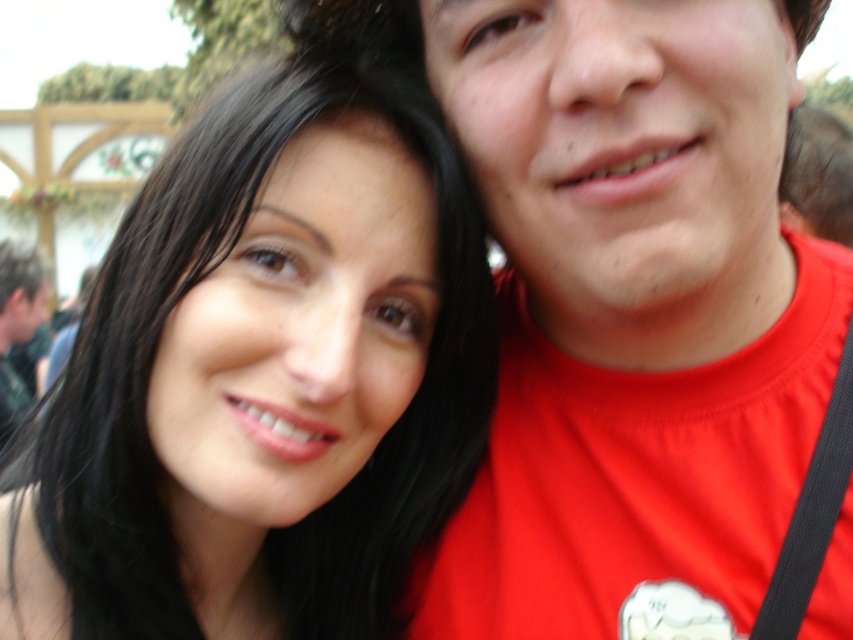
Please look at the image and identify the object located at the coordinates point (x=262, y=378). Your answer should specify the exact object label from the provided list.

The point (x=262, y=378) indicates smooth black hair at upper left.

You are a photographer trying to adjust the focus of your camera. The camera has a focus point at coordinate 0.5, 0.3. Which object in the scene should you focus on to capture the smooth black hair at upper left clearly?

The smooth black hair at upper left is located at point (262, 378), which is very close to the camera focus point at (254, 320). Therefore, focusing at (254, 320) will effectively capture the smooth black hair at upper left in focus.